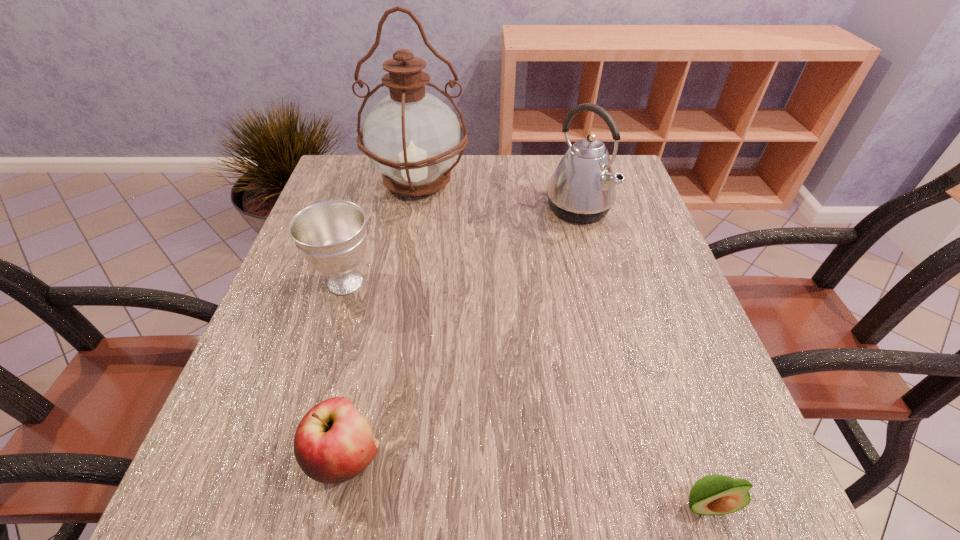
This screenshot has width=960, height=540. What are the coordinates of `object that ranks as the third closest to the avocado` in the screenshot? It's located at (331, 235).

At what (x,y) coordinates should I click in order to perform the action: click on object that is the second closest to the apple. Please return your answer as a coordinate pair (x, y). Looking at the image, I should click on (715, 494).

Find the location of a particular element. Image resolution: width=960 pixels, height=540 pixels. blank space that satisfies the following two spatial constraints: 1. on the front side of the third shortest object; 2. on the left side of the apple is located at coordinates (293, 457).

Where is `free space that satisfies the following two spatial constraints: 1. on the back side of the apple; 2. on the left side of the second tallest object`? The width and height of the screenshot is (960, 540). free space that satisfies the following two spatial constraints: 1. on the back side of the apple; 2. on the left side of the second tallest object is located at coordinates (399, 208).